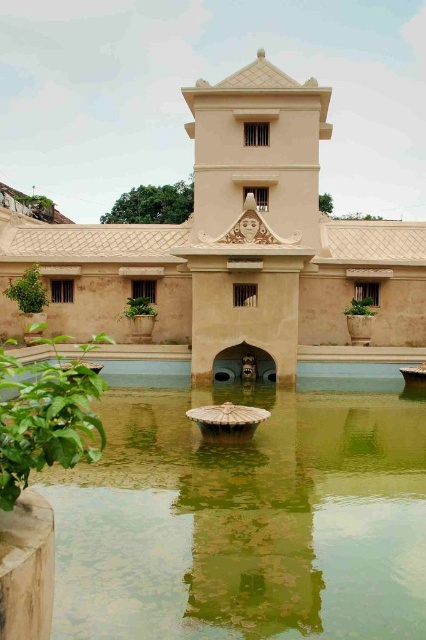
Can you confirm if green stone water at center is wider than beige stone palace at center?

Incorrect, green stone water at center's width does not surpass beige stone palace at center's.

The height and width of the screenshot is (640, 426). In order to click on green stone water at center in this screenshot , I will do `click(245, 520)`.

Who is more distant from viewer, (164, 442) or (201, 122)?

The point (201, 122) is more distant.

This screenshot has width=426, height=640. Identify the location of green stone water at center. (245, 520).